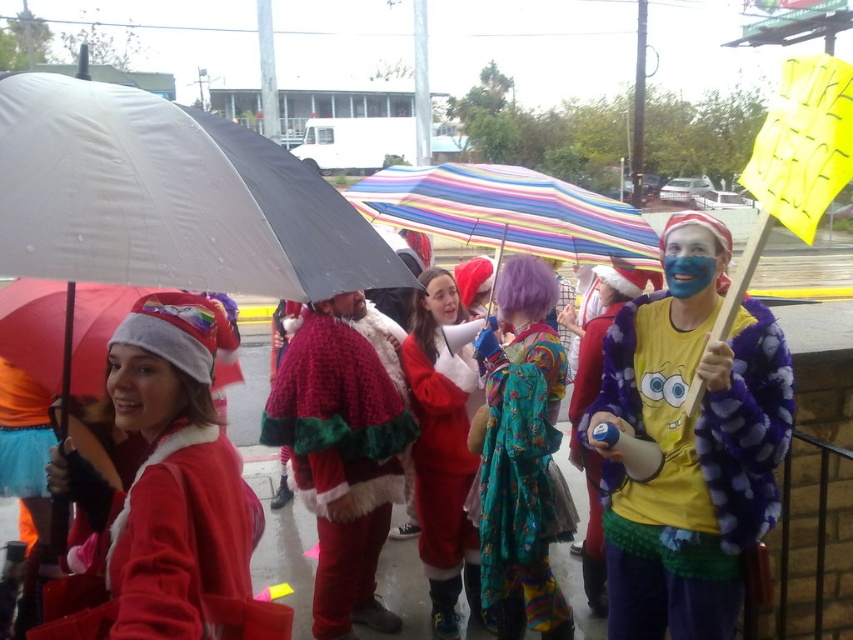
You are a photographer trying to capture the entire scene in one shot. The velvet santa suit at center and the striped fabric umbrella at center are both in the frame. Given their sizes, which object would appear smaller in the photo?

The velvet santa suit at center appears smaller in the photo because it has a smaller size compared to the striped fabric umbrella at center.

You are organizing a parade float and need to place the velvet santa suit at center and the striped fabric umbrella at center on a platform. Given their widths, which object should be placed closer to the edge to avoid overcrowding?

The velvet santa suit at center has a lesser width compared to the striped fabric umbrella at center, so placing the velvet santa suit at center closer to the edge would help avoid overcrowding since it takes up less space.